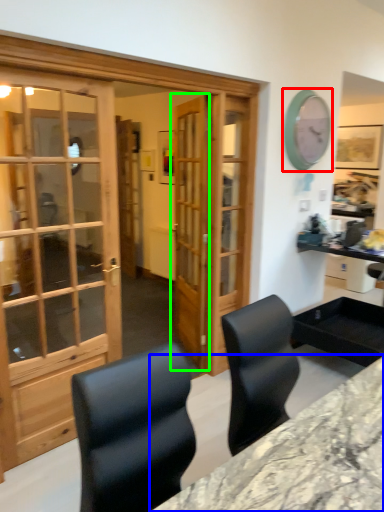
Question: Which object is positioned closest to clock (highlighted by a red box)? Select from desk (highlighted by a blue box) and door (highlighted by a green box).

Choices:
 (A) desk
 (B) door

Answer: (B)